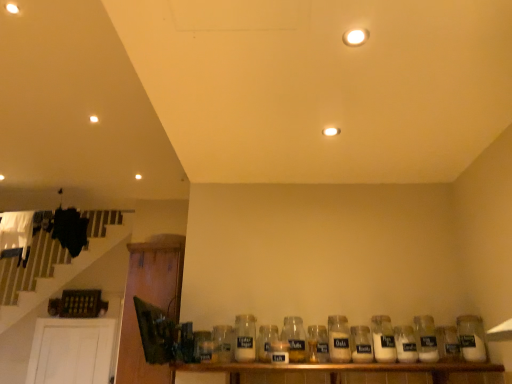
Where is `white glass bottle at center, the ninth bottle positioned from the left`? white glass bottle at center, the ninth bottle positioned from the left is located at coordinates (405, 344).

What do you see at coordinates (361, 344) in the screenshot?
I see `clear glass jar at center, the 7th bottle viewed from the left` at bounding box center [361, 344].

Describe the element at coordinates (266, 341) in the screenshot. The height and width of the screenshot is (384, 512). I see `clear glass jar at center, which is the 3th bottle from left to right` at that location.

This screenshot has height=384, width=512. What are the coordinates of `clear glass jar at center, the 11th bottle positioned from the right` in the screenshot? It's located at (223, 343).

I want to click on white glass jar at lower right, arranged as the 1th bottle when viewed from the right, so click(x=471, y=338).

Based on the photo, how many degrees apart are the facing directions of clear glass jar at center, marked as the tenth bottle in a left-to-right arrangement, and white glass jar at center, which is the 8th bottle in left-to-right order?

0.000425 degrees separate the facing orientations of clear glass jar at center, marked as the tenth bottle in a left-to-right arrangement, and white glass jar at center, which is the 8th bottle in left-to-right order.

Does clear glass jar at center, placed as the 2th bottle when sorted from right to left, have a lesser height compared to white glass jar at center, positioned as the 4th bottle in right-to-left order?

Indeed, clear glass jar at center, placed as the 2th bottle when sorted from right to left, has a lesser height compared to white glass jar at center, positioned as the 4th bottle in right-to-left order.

Is clear glass jar at center, marked as the tenth bottle in a left-to-right arrangement, facing towards white glass jar at center, which is the 8th bottle in left-to-right order?

No, clear glass jar at center, marked as the tenth bottle in a left-to-right arrangement, is not oriented towards white glass jar at center, which is the 8th bottle in left-to-right order.

From the image's perspective, which is below, clear glass jar at center, placed as the 2th bottle when sorted from right to left, or white glass jar at center, positioned as the 4th bottle in right-to-left order?

From the image's view, white glass jar at center, positioned as the 4th bottle in right-to-left order, is below.

Are matte white light fixture at upper left, the first lighting positioned from the top, and clear glass jar at center, marked as the tenth bottle in a left-to-right arrangement, far apart?

Indeed, matte white light fixture at upper left, the first lighting positioned from the top, is not near clear glass jar at center, marked as the tenth bottle in a left-to-right arrangement.

From the image's perspective, is matte white light fixture at upper left, positioned as the 1th lighting in back-to-front order, above or below clear glass jar at center, placed as the 2th bottle when sorted from right to left?

Based on their image positions, matte white light fixture at upper left, positioned as the 1th lighting in back-to-front order, is located above clear glass jar at center, placed as the 2th bottle when sorted from right to left.

Locate an element on the screen. lighting that is the 3rd object to the left of the clear glass jar at center, placed as the 2th bottle when sorted from right to left, starting at the anchor is located at coordinates (94, 119).

From a real-world perspective, which is physically below, matte white light fixture at upper left, the 1th lighting from the left, or clear glass jar at center, marked as the tenth bottle in a left-to-right arrangement?

From a 3D spatial view, clear glass jar at center, marked as the tenth bottle in a left-to-right arrangement, is below.

Can you tell me how much clear glass jar at center, the 11th bottle positioned from the right, and matte white light fixture at center, which appears as the first lighting when viewed from the right, differ in facing direction?

92.5 degrees separate the facing orientations of clear glass jar at center, the 11th bottle positioned from the right, and matte white light fixture at center, which appears as the first lighting when viewed from the right.

Is clear glass jar at center, which ranks as the 1th bottle in left-to-right order, further to camera compared to matte white light fixture at center, positioned as the 3th lighting in top-to-bottom order?

Yes, the depth of clear glass jar at center, which ranks as the 1th bottle in left-to-right order, is greater than that of matte white light fixture at center, positioned as the 3th lighting in top-to-bottom order.

Considering the sizes of clear glass jar at center, the 11th bottle positioned from the right, and matte white light fixture at center, which appears as the first lighting when viewed from the right, in the image, is clear glass jar at center, the 11th bottle positioned from the right, wider or thinner than matte white light fixture at center, which appears as the first lighting when viewed from the right,?

Clearly, clear glass jar at center, the 11th bottle positioned from the right, has more width compared to matte white light fixture at center, which appears as the first lighting when viewed from the right.

Can you confirm if clear glass jar at center, which ranks as the 1th bottle in left-to-right order, is shorter than matte white light fixture at center, which appears as the first lighting when viewed from the right?

No, clear glass jar at center, which ranks as the 1th bottle in left-to-right order, is not shorter than matte white light fixture at center, which appears as the first lighting when viewed from the right.

Can you confirm if matte white light fixture at upper left, the 3th lighting viewed from the front, is taller than clear glass jar at center, which is the fifth bottle in right-to-left order?

Incorrect, the height of matte white light fixture at upper left, the 3th lighting viewed from the front, is not larger of that of clear glass jar at center, which is the fifth bottle in right-to-left order.

Is point (90, 118) behind point (360, 342)?

Yes, point (90, 118) is farther from viewer.

This screenshot has width=512, height=384. In order to click on the 3rd lighting to the left when counting from the clear glass jar at center, the 7th bottle viewed from the left in this screenshot , I will do `click(94, 119)`.

Is matte white light fixture at upper left, which appears as the 3th lighting when ordered from the bottom, next to clear glass jar at center, the 7th bottle viewed from the left, and touching it?

No, matte white light fixture at upper left, which appears as the 3th lighting when ordered from the bottom, is not next to clear glass jar at center, the 7th bottle viewed from the left.

Consider the image. Is clear glass jar at center, which ranks as the second bottle in left-to-right order, wider or thinner than white glass jar at lower right, arranged as the 1th bottle when viewed from the right?

Considering their sizes, clear glass jar at center, which ranks as the second bottle in left-to-right order, looks slimmer than white glass jar at lower right, arranged as the 1th bottle when viewed from the right.

From the image's perspective, between clear glass jar at center, which ranks as the second bottle in left-to-right order, and white glass jar at lower right, arranged as the eleventh bottle when viewed from the left, which one is located above?

white glass jar at lower right, arranged as the eleventh bottle when viewed from the left.

Could you measure the distance between clear glass jar at center, which is counted as the 10th bottle, starting from the right, and white glass jar at lower right, arranged as the eleventh bottle when viewed from the left?

A distance of 3.49 feet exists between clear glass jar at center, which is counted as the 10th bottle, starting from the right, and white glass jar at lower right, arranged as the eleventh bottle when viewed from the left.

Which point is more forward, (250, 344) or (482, 338)?

The point (482, 338) is closer to the camera.

Is clear glass jar at center, the 11th bottle positioned from the right, at the back of wooden shelf at lower center?

wooden shelf at lower center does not have its back to clear glass jar at center, the 11th bottle positioned from the right.

From a real-world perspective, is wooden shelf at lower center physically above clear glass jar at center, which ranks as the 1th bottle in left-to-right order?

No, from a real-world perspective, wooden shelf at lower center is not over clear glass jar at center, which ranks as the 1th bottle in left-to-right order

Is wooden shelf at lower center shorter than clear glass jar at center, which ranks as the 1th bottle in left-to-right order?

Yes.

Do you think wooden shelf at lower center is within clear glass jar at center, the 11th bottle positioned from the right, or outside of it?

wooden shelf at lower center lies outside clear glass jar at center, the 11th bottle positioned from the right.

From a real-world perspective, is white glass jar at center, which is the 8th bottle in left-to-right order, physically above clear glass jar at center, which is the fifth bottle in right-to-left order?

Indeed, from a real-world perspective, white glass jar at center, which is the 8th bottle in left-to-right order, stands above clear glass jar at center, which is the fifth bottle in right-to-left order.

Is white glass jar at center, positioned as the 4th bottle in right-to-left order, to the left of clear glass jar at center, the 7th bottle viewed from the left, from the viewer's perspective?

No.

Which is behind, point (387, 355) or point (365, 338)?

Positioned behind is point (365, 338).

Could clear glass jar at center, the 7th bottle viewed from the left, be considered to be inside white glass jar at center, positioned as the 4th bottle in right-to-left order?

No, white glass jar at center, positioned as the 4th bottle in right-to-left order, does not contain clear glass jar at center, the 7th bottle viewed from the left.

Where is `bottle positioned vertically above the clear glass jar at center, placed as the 2th bottle when sorted from right to left (from a real-world perspective)`? The width and height of the screenshot is (512, 384). bottle positioned vertically above the clear glass jar at center, placed as the 2th bottle when sorted from right to left (from a real-world perspective) is located at coordinates (383, 339).

From a real-world perspective, starting from the matte white light fixture at upper left, positioned as the 1th lighting in back-to-front order, which bottle is the 2nd one below it? Please provide its 2D coordinates.

[(426, 338)]

Which object lies further to the anchor point clear glass jar at center, arranged as the ninth bottle when viewed from the right, clear glass jar at center, which is the seventh bottle in right-to-left order, or clear glass jar at center, the 11th bottle positioned from the right?

The object further to clear glass jar at center, arranged as the ninth bottle when viewed from the right, is clear glass jar at center, which is the seventh bottle in right-to-left order.

Based on their spatial positions, is white glass jar at center, which is counted as the sixth bottle, starting from the left, or clear glass jar at center, marked as the tenth bottle in a left-to-right arrangement, further from clear glass jar at center, arranged as the eighth bottle when viewed from the right?

clear glass jar at center, marked as the tenth bottle in a left-to-right arrangement, is further to clear glass jar at center, arranged as the eighth bottle when viewed from the right.

From the image, which object appears to be farther from clear glass jar at center, which is the fourth bottle in left-to-right order, matte white light fixture at upper right, marked as the 3th lighting in a back-to-front arrangement, or clear glass jar at center, which is the seventh bottle in right-to-left order?

The object further to clear glass jar at center, which is the fourth bottle in left-to-right order, is matte white light fixture at upper right, marked as the 3th lighting in a back-to-front arrangement.

When comparing their distances from clear glass jar at center, which ranks as the second bottle in left-to-right order, does clear glass jar at center, placed as the 2th bottle when sorted from right to left, or clear glass jar at center, arranged as the ninth bottle when viewed from the right, seem closer?

clear glass jar at center, arranged as the ninth bottle when viewed from the right, is closer to clear glass jar at center, which ranks as the second bottle in left-to-right order.

Considering their positions, is clear glass jar at center, which is the 3th bottle from left to right, positioned closer to white glass jar at lower right, arranged as the 1th bottle when viewed from the right, than white glass bottle at center, which is counted as the 3th bottle, starting from the right?

white glass bottle at center, which is counted as the 3th bottle, starting from the right.

Which object lies nearer to the anchor point clear glass jar at center, which is counted as the 10th bottle, starting from the right, white glass bottle at center, the ninth bottle positioned from the left, or wooden shelf at lower center?

The object closer to clear glass jar at center, which is counted as the 10th bottle, starting from the right, is wooden shelf at lower center.

From the image, which object appears to be farther from clear glass jar at center, which is counted as the 10th bottle, starting from the right, clear glass jar at center, arranged as the ninth bottle when viewed from the right, or white glass jar at center, which is the 8th bottle in left-to-right order?

white glass jar at center, which is the 8th bottle in left-to-right order, is positioned further to the anchor clear glass jar at center, which is counted as the 10th bottle, starting from the right.

Looking at this image, from the image, which object appears to be nearer to white glass jar at lower right, arranged as the 1th bottle when viewed from the right, clear glass jar at center, which is the 3th bottle from left to right, or clear glass jar at center, the 11th bottle positioned from the right?

The object closer to white glass jar at lower right, arranged as the 1th bottle when viewed from the right, is clear glass jar at center, which is the 3th bottle from left to right.

Find the location of a particular element. table between matte white light fixture at upper left, which appears as the 3th lighting when ordered from the bottom, and white glass bottle at center, the ninth bottle positioned from the left is located at coordinates (349, 373).

Find the location of a particular element. This screenshot has width=512, height=384. table located between clear glass jar at center, which is counted as the 10th bottle, starting from the right, and clear glass jar at center, which is the fifth bottle in right-to-left order, in the left-right direction is located at coordinates (349, 373).

This screenshot has height=384, width=512. I want to click on bottle situated between clear glass jar at center, which is the fourth bottle in left-to-right order, and white glass jar at center, which is counted as the sixth bottle, starting from the left, from left to right, so click(317, 344).

The height and width of the screenshot is (384, 512). In order to click on lighting between matte white light fixture at upper right, which is counted as the 2th lighting, starting from the left, and clear glass jar at center, which is counted as the fifth bottle, starting from the left, from top to bottom in this screenshot , I will do `click(331, 131)`.